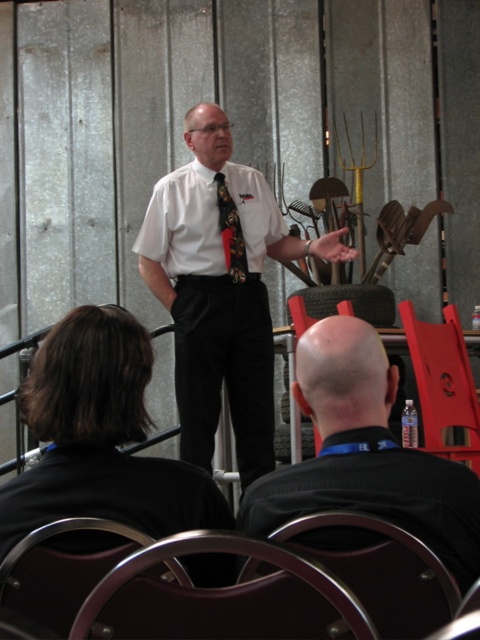
Question: Estimate the real-world distances between objects in this image. Which object is farther from the black satin tie at center?

Choices:
 (A) metallic silver chair at lower left
 (B) metallic silver chair at lower center
 (C) white shirt at center

Answer: (B)

Question: In this image, where is metallic silver chair at lower center located relative to metallic silver chair at lower left?

Choices:
 (A) left
 (B) right

Answer: (B)

Question: Which point appears farthest from the camera in this image?

Choices:
 (A) (274, 257)
 (B) (336, 529)
 (C) (249, 225)
 (D) (243, 621)

Answer: (A)

Question: Which point is farther from the camera taking this photo?

Choices:
 (A) (453, 339)
 (B) (203, 116)

Answer: (B)

Question: Does dark brown hair at lower left appear on the right side of matte plastic chair at lower right?

Choices:
 (A) no
 (B) yes

Answer: (A)

Question: Is dark brown hair at lower left wider than metallic dark brown chair at lower center?

Choices:
 (A) no
 (B) yes

Answer: (B)